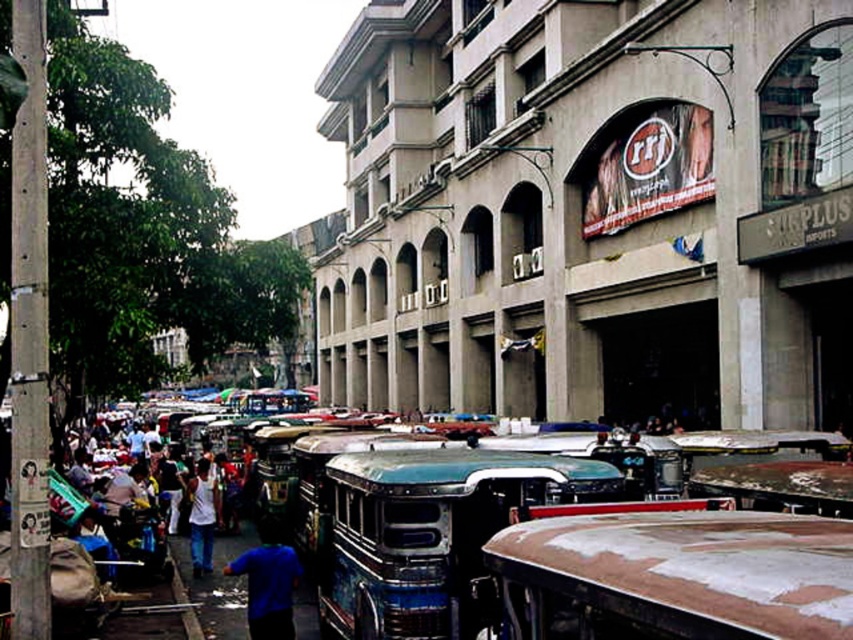
You are a pedestrian standing on the sidewalk looking at the scene. You see the rusty metal bus at center and the blue matte shirt at lower center. Which object is positioned higher from the ground?

The rusty metal bus at center is located above the blue matte shirt at lower center, so the rusty metal bus at center is positioned higher from the ground.

From the picture: You are a pedestrian standing at the edge of the street and see the rusty metal bus at center and the white matte shirt at center. Which object is located to the right of the other?

The rusty metal bus at center is positioned on the right side of white matte shirt at center.